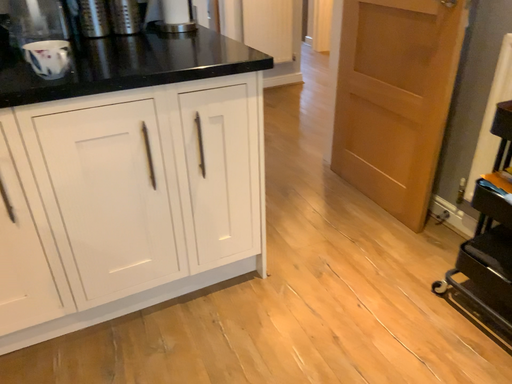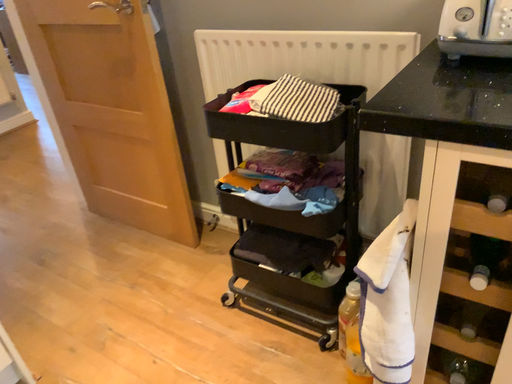
Question: How did the camera likely rotate when shooting the video?

Choices:
 (A) rotated right
 (B) rotated left

Answer: (A)